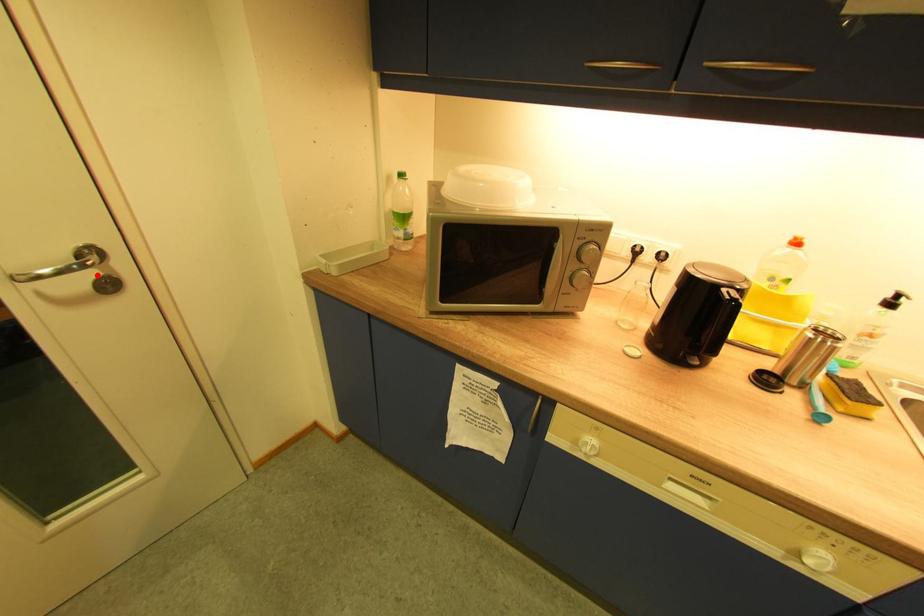
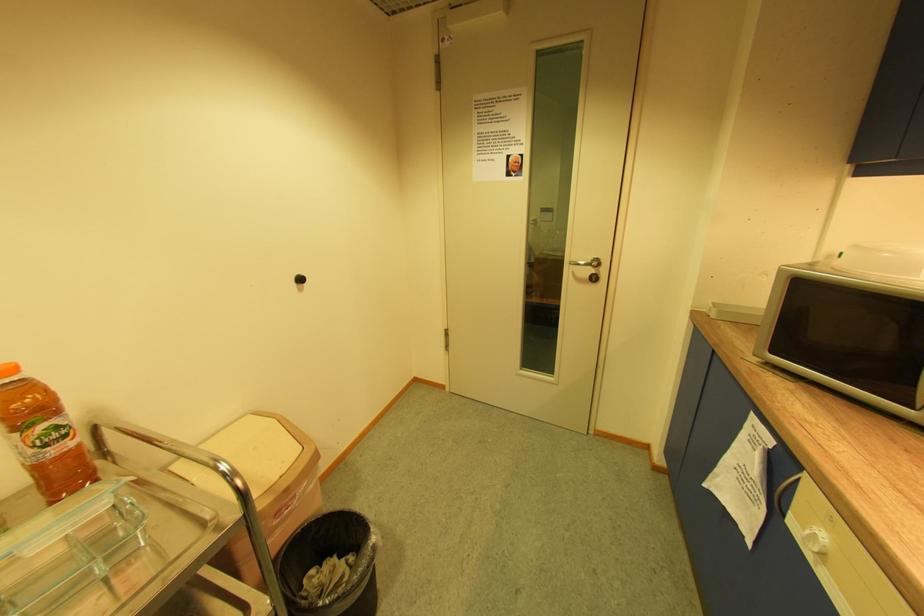
Question: I am providing you with two images of the same scene from different viewpoints. A red point is marked on the first image. At the location where the point appears in image 1, is it still visible in image 2?

Choices:
 (A) Yes
 (B) No

Answer: (A)